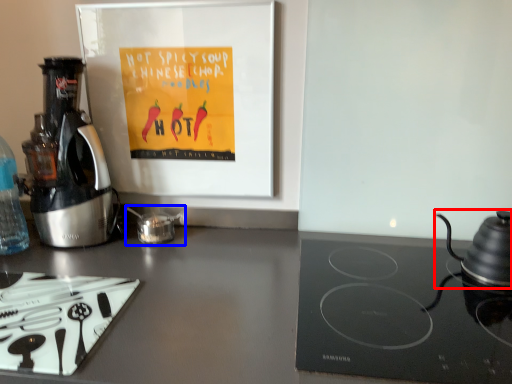
Question: Which point is closer to the camera, kitchen appliance (highlighted by a red box) or tea pot (highlighted by a blue box)?

Choices:
 (A) kitchen appliance
 (B) tea pot

Answer: (A)